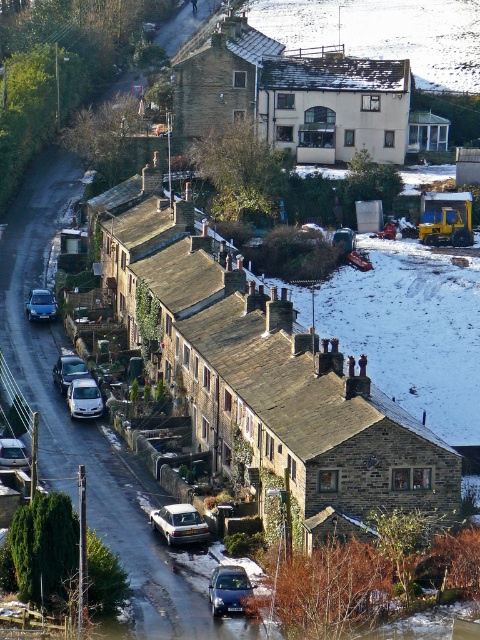
Question: Is white matte car at lower center bigger than matte blue car at left?

Choices:
 (A) no
 (B) yes

Answer: (B)

Question: Does white matte car at lower center have a larger size compared to silver metallic car at lower left?

Choices:
 (A) no
 (B) yes

Answer: (B)

Question: Which object is the farthest from the white matte car at lower center?

Choices:
 (A) matte blue car at left
 (B) white matte van at center

Answer: (A)

Question: Can you confirm if white matte van at center is thinner than matte blue car at left?

Choices:
 (A) no
 (B) yes

Answer: (A)

Question: Which point is farther from the camera taking this photo?

Choices:
 (A) (12, 445)
 (B) (222, 602)
 (C) (204, 531)

Answer: (A)

Question: Which point is farther to the camera?

Choices:
 (A) silver metallic car at lower left
 (B) matte blue car at left
 (C) white matte car at lower center

Answer: (B)